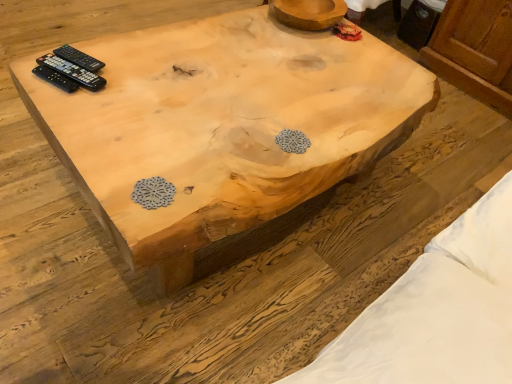
I want to click on free area behind black plastic remote control at upper left, arranged as the 3th remote control when viewed from the front, so point(109,41).